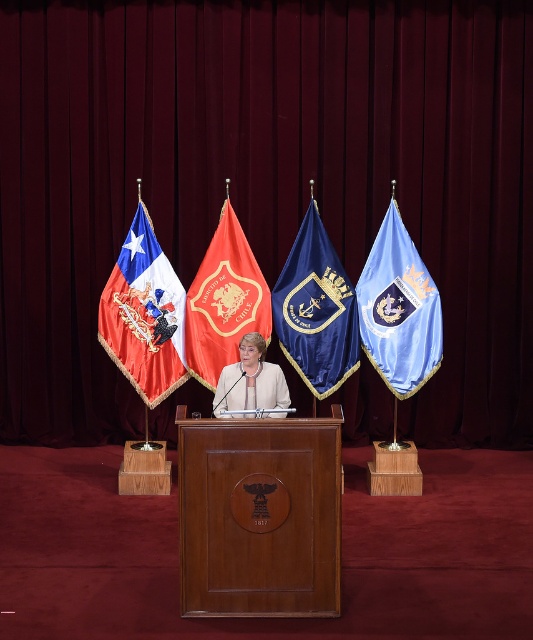
Locate an element on the screen. light blue fabric flag at right is located at coordinates (399, 308).

Can you confirm if dark red velvet curtain at center is taller than navy blue fabric flag at center?

Yes, dark red velvet curtain at center is taller than navy blue fabric flag at center.

Does dark red velvet curtain at center appear over navy blue fabric flag at center?

Yes, dark red velvet curtain at center is above navy blue fabric flag at center.

Is point (527, 106) positioned behind point (300, 257)?

Yes, point (527, 106) is behind point (300, 257).

Image resolution: width=533 pixels, height=640 pixels. I want to click on dark red velvet curtain at center, so click(x=263, y=179).

Between red satin flag at left and light blue fabric flag at right, which one has more height?

red satin flag at left is taller.

How much distance is there between red satin flag at left and light blue fabric flag at right?

red satin flag at left and light blue fabric flag at right are 1.72 meters apart.

The image size is (533, 640). What are the coordinates of `red satin flag at left` in the screenshot? It's located at (143, 314).